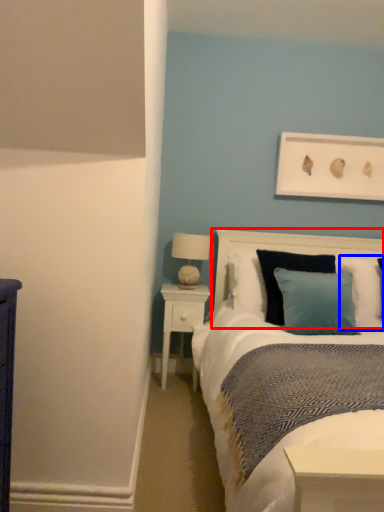
Question: Which point is further to the camera, headboard (highlighted by a red box) or pillow (highlighted by a blue box)?

Choices:
 (A) headboard
 (B) pillow

Answer: (B)